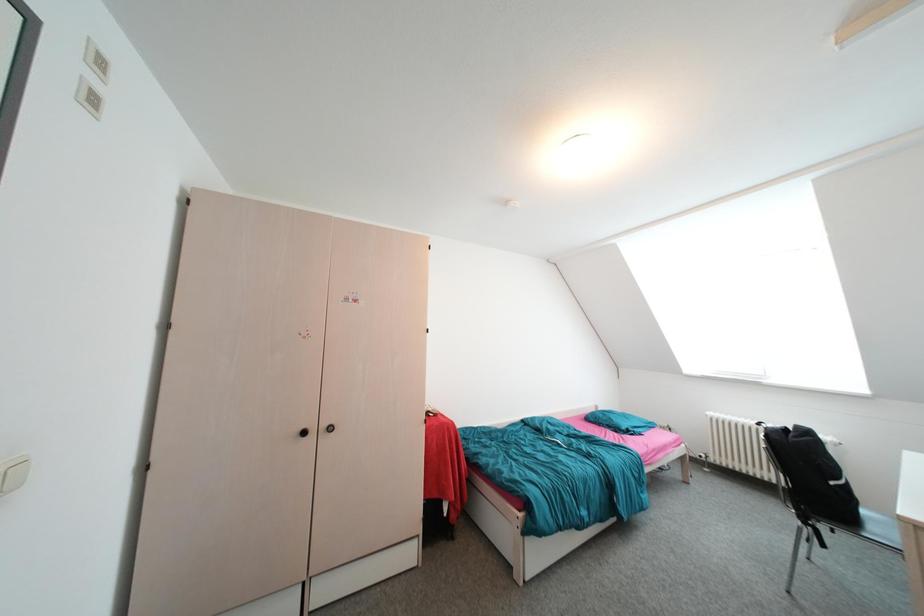
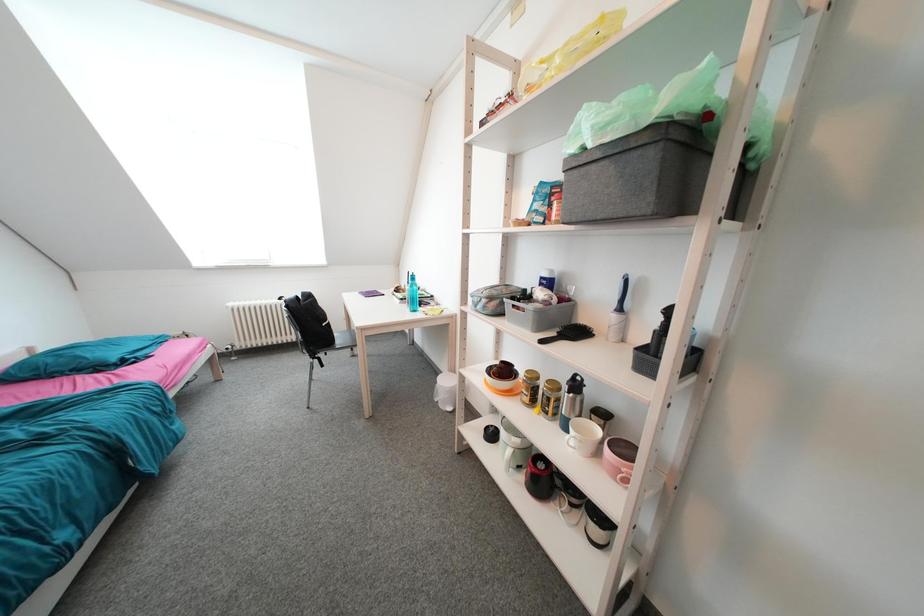
How did the camera likely rotate?

A: The camera rotated toward right-down.